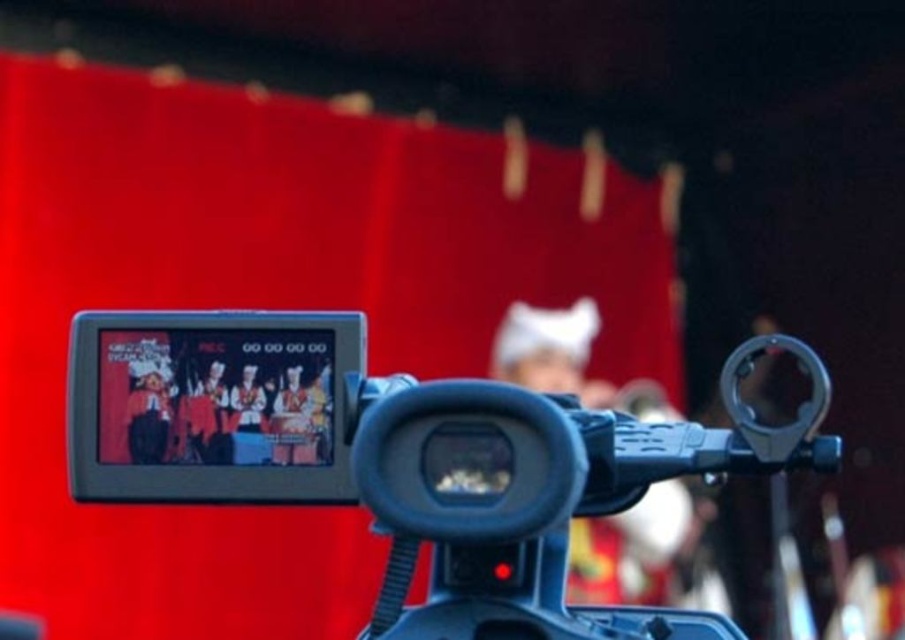
Question: Which of the following is the farthest from the observer?

Choices:
 (A) (205, 380)
 (B) (141, 344)

Answer: (B)

Question: Among these objects, which one is nearest to the camera?

Choices:
 (A) black plastic video camera at center
 (B) matte black screen at center

Answer: (A)

Question: Does black plastic video camera at center appear over matte black screen at center?

Choices:
 (A) yes
 (B) no

Answer: (B)

Question: Can you confirm if black plastic video camera at center is wider than matte black screen at center?

Choices:
 (A) yes
 (B) no

Answer: (A)

Question: Does black plastic video camera at center appear on the right side of matte black screen at center?

Choices:
 (A) no
 (B) yes

Answer: (B)

Question: Which point appears farthest from the camera in this image?

Choices:
 (A) (126, 444)
 (B) (88, 381)

Answer: (B)